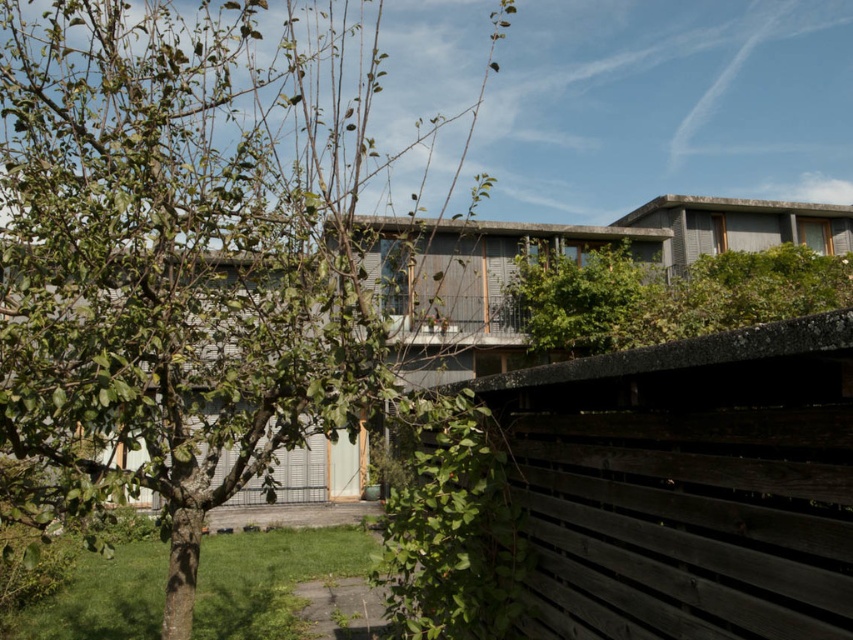
Question: From the image, what is the correct spatial relationship of green leafy tree at center in relation to dark gray wooden fence at center?

Choices:
 (A) right
 (B) left

Answer: (B)

Question: Is green leafy tree at center bigger than dark gray wooden fence at center?

Choices:
 (A) no
 (B) yes

Answer: (B)

Question: Among these points, which one is nearest to the camera?

Choices:
 (A) (86, 388)
 (B) (606, 449)

Answer: (B)

Question: Among these objects, which one is nearest to the camera?

Choices:
 (A) green leafy tree at center
 (B) dark gray wooden fence at center

Answer: (B)

Question: Which point appears farthest from the camera in this image?

Choices:
 (A) tap(735, 365)
 (B) tap(91, 70)

Answer: (B)

Question: Is green leafy tree at center to the right of dark gray wooden fence at center from the viewer's perspective?

Choices:
 (A) yes
 (B) no

Answer: (B)